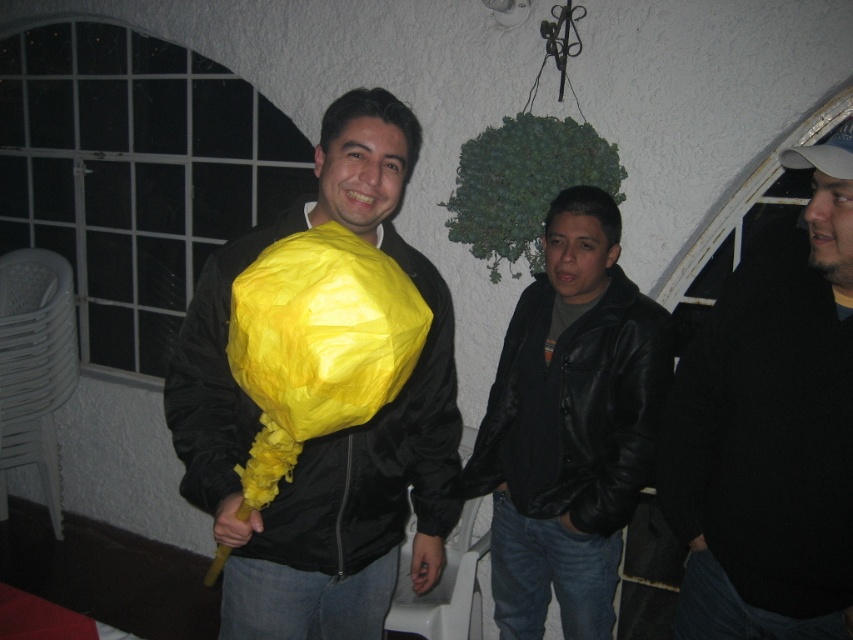
You are standing in the room and want to hand the large, bright yellow object to the person wearing the dark gray knit sweater at right. Based on their position, can you estimate how far to your right you need to move to reach them?

The dark gray knit sweater at right is located at coordinates 0.670 on the x and 0.904 on the y axis. To reach them, move approximately 67.0 percent to the right and 90.4 percent forward from your current position.